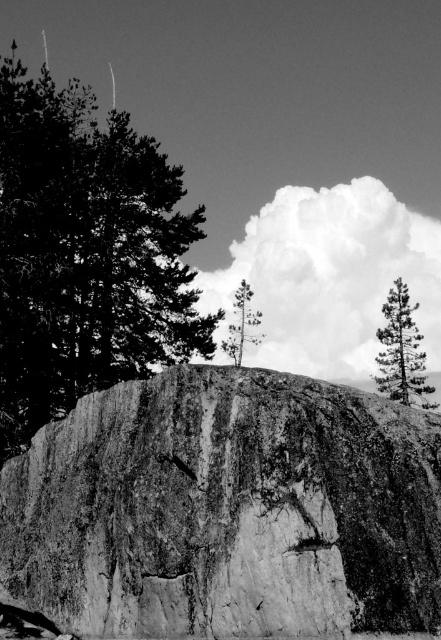
Is dark green textured tree at upper left to the left of smooth bark tree at upper right from the viewer's perspective?

Indeed, dark green textured tree at upper left is positioned on the left side of smooth bark tree at upper right.

Can you confirm if dark green textured tree at upper left is shorter than smooth bark tree at upper right?

Incorrect, dark green textured tree at upper left's height does not fall short of smooth bark tree at upper right's.

The height and width of the screenshot is (640, 441). What do you see at coordinates (85, 253) in the screenshot? I see `dark green textured tree at upper left` at bounding box center [85, 253].

At what (x,y) coordinates should I click in order to perform the action: click on dark green textured tree at upper left. Please return your answer as a coordinate pair (x, y). Image resolution: width=441 pixels, height=640 pixels. Looking at the image, I should click on (85, 253).

Does dark green textured tree at upper left have a lesser height compared to smooth green tree at center?

No.

Does dark green textured tree at upper left come in front of smooth green tree at center?

That is True.

Locate an element on the screen. dark green textured tree at upper left is located at coordinates (85, 253).

Measure the distance between granite rock at center and smooth green tree at center.

granite rock at center and smooth green tree at center are 213.29 feet apart from each other.

Does granite rock at center have a lesser width compared to smooth green tree at center?

In fact, granite rock at center might be wider than smooth green tree at center.

Does point (142, 390) come closer to viewer compared to point (258, 323)?

Yes.

I want to click on granite rock at center, so click(227, 509).